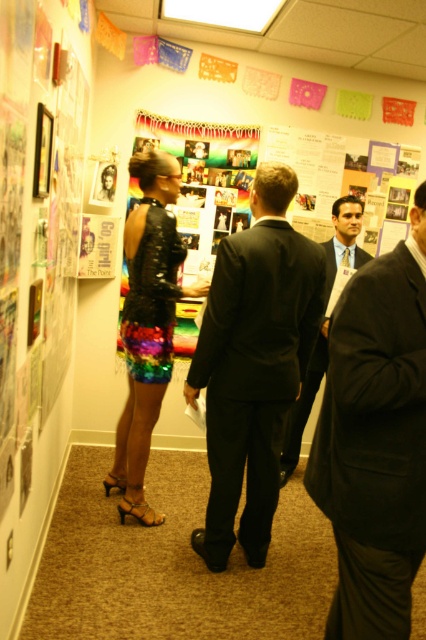
Question: Which point is farther from the camera taking this photo?

Choices:
 (A) (155, 333)
 (B) (195, 532)
 (C) (420, 380)

Answer: (B)

Question: Does black matte suit at center have a smaller size compared to rainbow sequined dress at center?

Choices:
 (A) no
 (B) yes

Answer: (A)

Question: Is black suit at center further to the viewer compared to rainbow sequined dress at center?

Choices:
 (A) yes
 (B) no

Answer: (B)

Question: Which point appears farthest from the camera in this image?

Choices:
 (A) (333, 218)
 (B) (138, 456)

Answer: (A)

Question: Does black suit at center come in front of shiny sequined dress at center?

Choices:
 (A) yes
 (B) no

Answer: (A)

Question: Which object is the closest to the rainbow sequined dress at center?

Choices:
 (A) shiny sequined dress at center
 (B) black matte suit at center

Answer: (A)